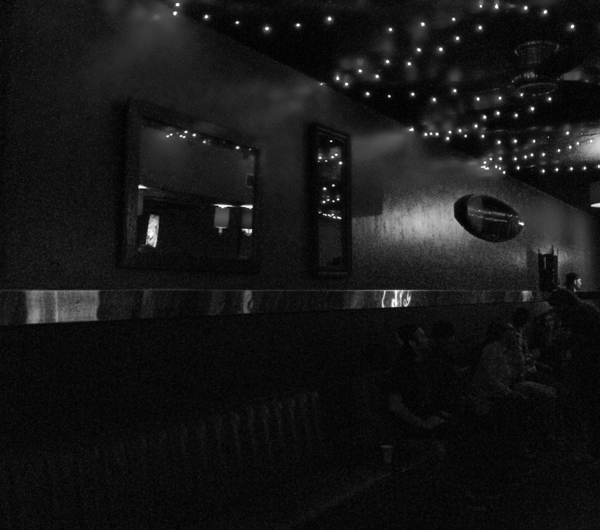
Where is `very dark room, like a bar maybe`? Image resolution: width=600 pixels, height=530 pixels. very dark room, like a bar maybe is located at coordinates (280, 118).